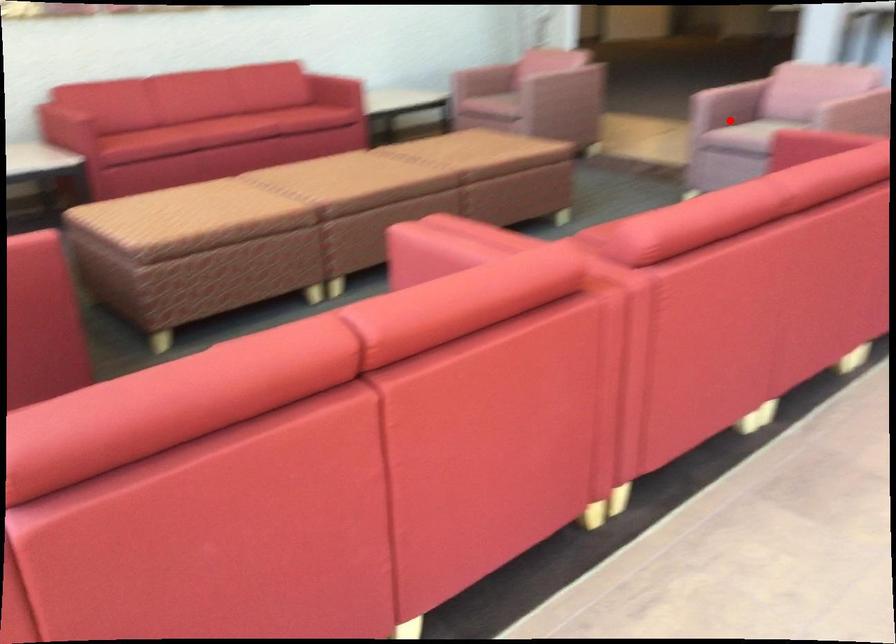
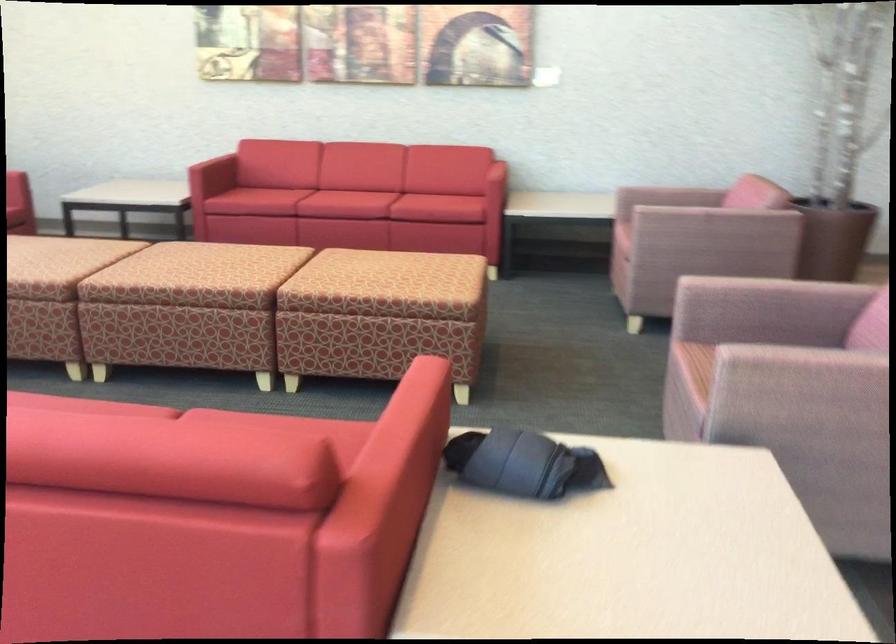
Question: A red point is marked in image1. In image2, is the corresponding 3D point closer to the camera or farther? Reply with the corresponding letter.

Choices:
 (A) The corresponding 3D point is closer.
 (B) The corresponding 3D point is farther.

Answer: (A)